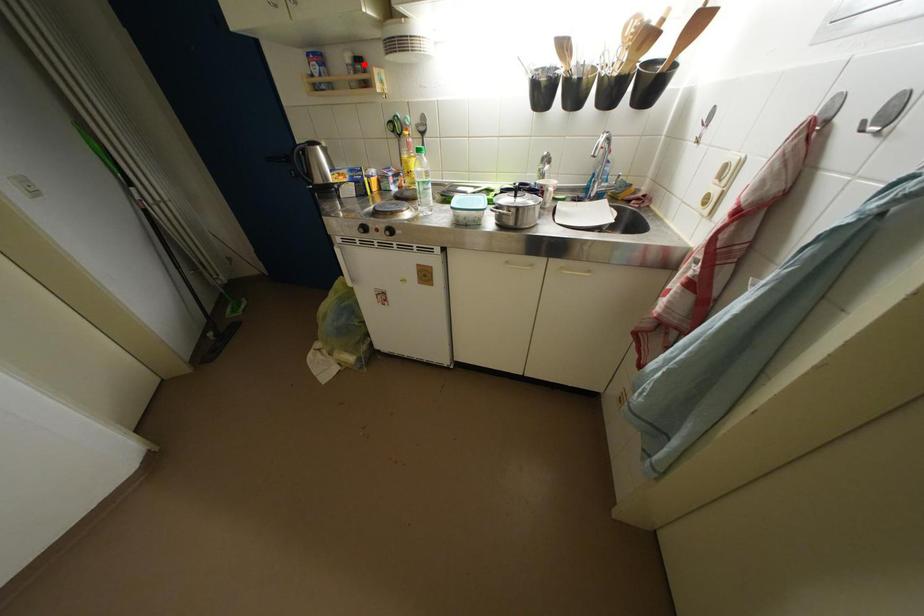
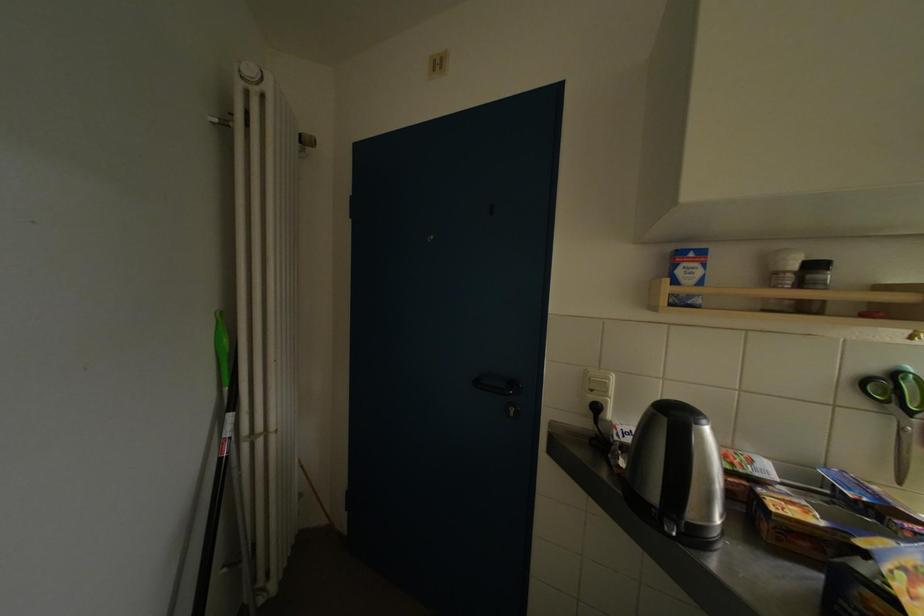
Find the pixel in the second image that matches the highlighted location in the first image.

(821, 270)